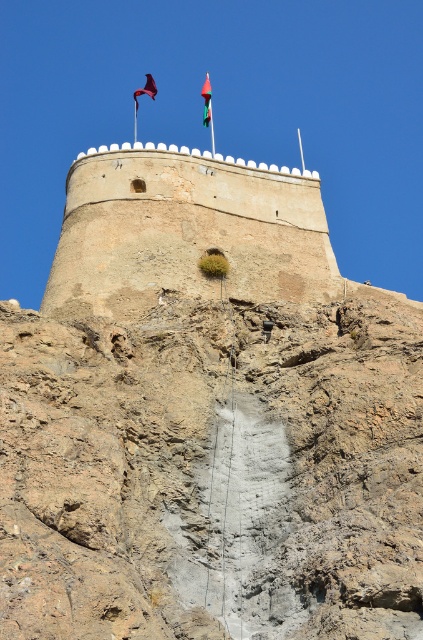
You are a historian examining the fortification from the ground below. You notice two flags at the upper center of the fortification. Which flag is located lower between the red fabric flag at upper center and the silky purple flag at upper center?

The red fabric flag at upper center is positioned under the silky purple flag at upper center, so the red fabric flag at upper center is lower.

You are a visitor standing at the base of the fortification looking up at the flags. Which flag, the red fabric flag at upper center or the silky purple flag at upper center, is closer to you?

The red fabric flag at upper center is closer to you because it is in front of the silky purple flag at upper center.